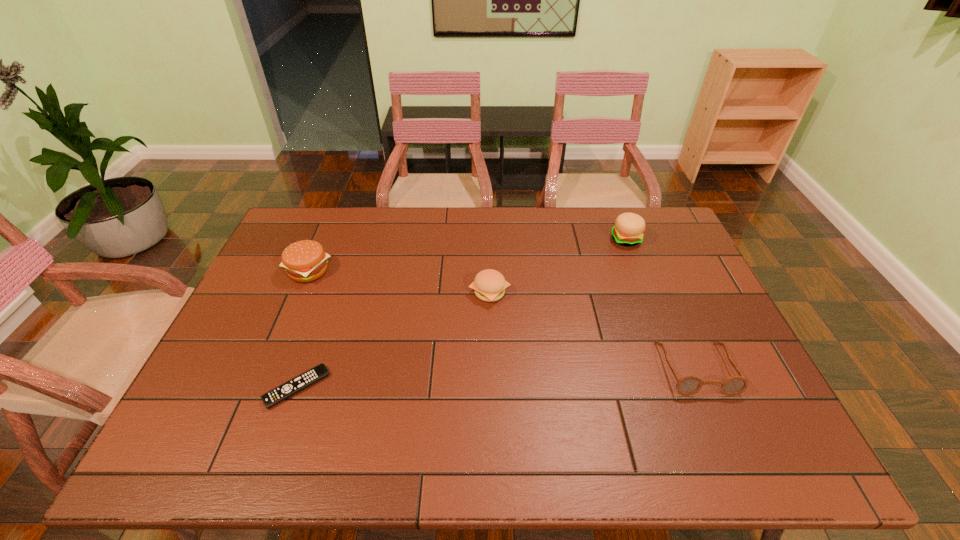
Image resolution: width=960 pixels, height=540 pixels. I want to click on vacant space at the far right corner of the desktop, so click(x=623, y=208).

Locate an element on the screen. free spot between the rightmost hamburger and the shortest object is located at coordinates (462, 313).

Where is `unoccupied position between the leftmost hamburger and the fourth tallest object`? The height and width of the screenshot is (540, 960). unoccupied position between the leftmost hamburger and the fourth tallest object is located at coordinates (502, 320).

Locate an element on the screen. The height and width of the screenshot is (540, 960). empty location between the fourth tallest object and the leftmost hamburger is located at coordinates (502, 320).

Locate an element on the screen. The width and height of the screenshot is (960, 540). vacant point located between the shortest object and the rightmost hamburger is located at coordinates (462, 313).

This screenshot has width=960, height=540. I want to click on free space between the shortest object and the farthest hamburger, so click(x=462, y=313).

Find the location of `free area in between the remote control and the second hamburger from left to right`. free area in between the remote control and the second hamburger from left to right is located at coordinates (394, 340).

The image size is (960, 540). In order to click on free space that is in between the leftmost hamburger and the farthest object in this screenshot , I will do `click(468, 255)`.

In order to click on free space between the second hamburger from right to left and the spectacles in this screenshot , I will do `click(592, 330)`.

Find the location of `vacant area that lies between the leftmost hamburger and the farthest hamburger`. vacant area that lies between the leftmost hamburger and the farthest hamburger is located at coordinates (468, 255).